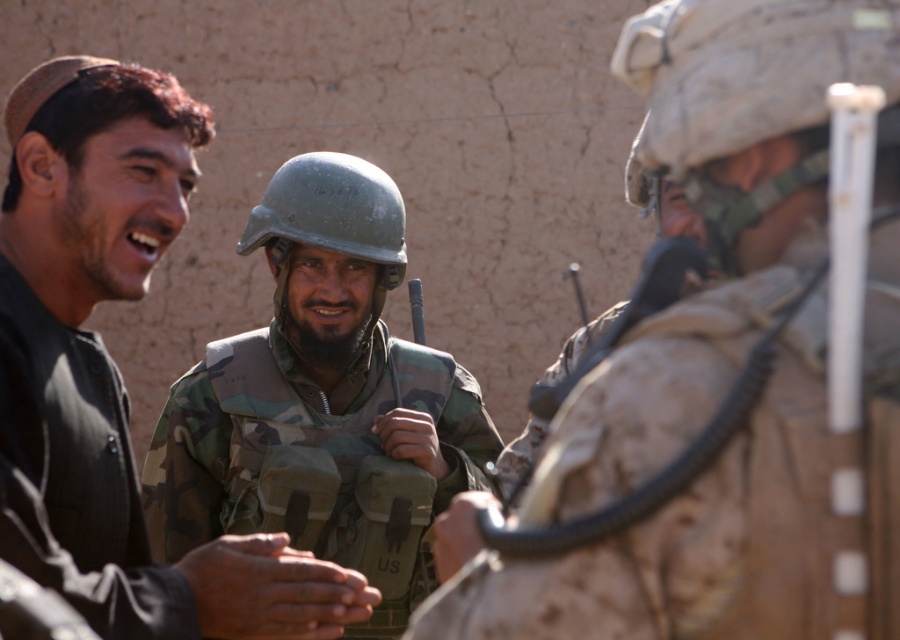
Question: Does camouflage fabric helmet at center appear over camouflage fabric helmet at upper right?

Choices:
 (A) yes
 (B) no

Answer: (B)

Question: Which point is closer to the camera?

Choices:
 (A) camouflage fabric helmet at center
 (B) camo fabric vest at center
 (C) camouflage fabric helmet at upper right

Answer: (A)

Question: Does camouflage fabric helmet at upper right appear on the right side of green matte helmet at center?

Choices:
 (A) no
 (B) yes

Answer: (B)

Question: Among these objects, which one is nearest to the camera?

Choices:
 (A) camouflage fabric helmet at upper right
 (B) green matte helmet at center
 (C) camouflage uniform at center
 (D) camo fabric vest at center

Answer: (A)

Question: Among these objects, which one is nearest to the camera?

Choices:
 (A) camo fabric vest at center
 (B) camouflage fabric helmet at center
 (C) camouflage fabric helmet at upper right
 (D) green matte helmet at center

Answer: (B)

Question: Does camouflage fabric helmet at center have a smaller size compared to camouflage fabric helmet at upper right?

Choices:
 (A) no
 (B) yes

Answer: (A)